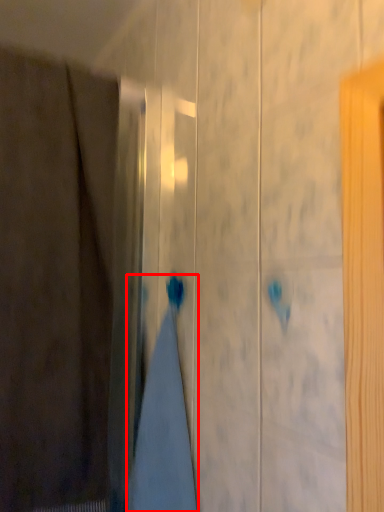
Question: In this image, where is bath towel (annotated by the red box) located relative to curtain?

Choices:
 (A) right
 (B) left

Answer: (A)